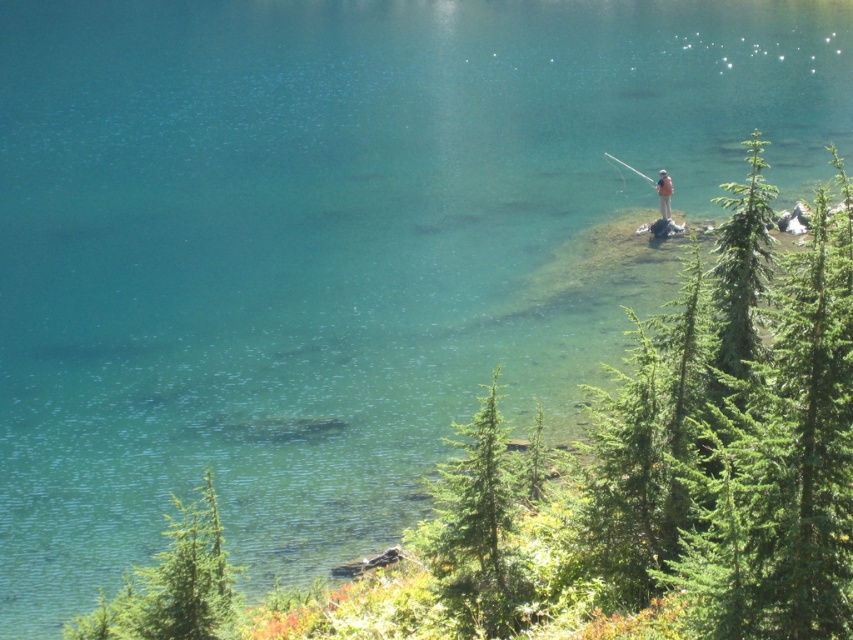
Question: Which object is the farthest from the green matte tree at lower left?

Choices:
 (A) green matte tree at lower center
 (B) camouflage fabric person at center

Answer: (B)

Question: Can you confirm if green matte tree at lower center is bigger than camouflage fabric person at center?

Choices:
 (A) yes
 (B) no

Answer: (A)

Question: Is green matte tree at lower center above camouflage fabric person at center?

Choices:
 (A) yes
 (B) no

Answer: (B)

Question: Which point is farther from the camera taking this photo?

Choices:
 (A) (421, 529)
 (B) (665, 198)
 (C) (177, 612)

Answer: (B)

Question: Does green matte tree at lower left appear on the left side of camouflage fabric person at center?

Choices:
 (A) yes
 (B) no

Answer: (A)

Question: Which point appears farthest from the camera in this image?

Choices:
 (A) (492, 566)
 (B) (660, 208)

Answer: (B)